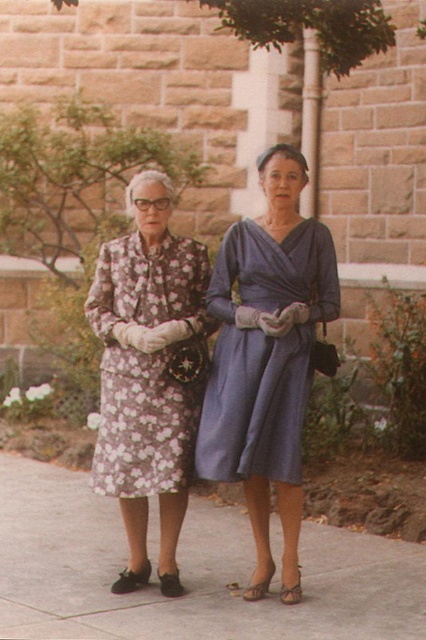
Question: Does matte blue dress at center appear on the left side of floral-patterned fabric dress at left?

Choices:
 (A) yes
 (B) no

Answer: (B)

Question: Among these points, which one is nearest to the camera?

Choices:
 (A) (368, 556)
 (B) (290, 288)

Answer: (B)

Question: Which object is positioned closest to the floral-patterned fabric dress at left?

Choices:
 (A) matte blue dress at center
 (B) gray concrete pavement at center

Answer: (A)

Question: Which point appears closest to the camera in this image?

Choices:
 (A) (268, 380)
 (B) (109, 401)

Answer: (A)

Question: Can you confirm if gray concrete pavement at center is positioned to the left of matte blue dress at center?

Choices:
 (A) no
 (B) yes

Answer: (B)

Question: Observing the image, what is the correct spatial positioning of gray concrete pavement at center in reference to floral-patterned fabric dress at left?

Choices:
 (A) above
 (B) below

Answer: (B)